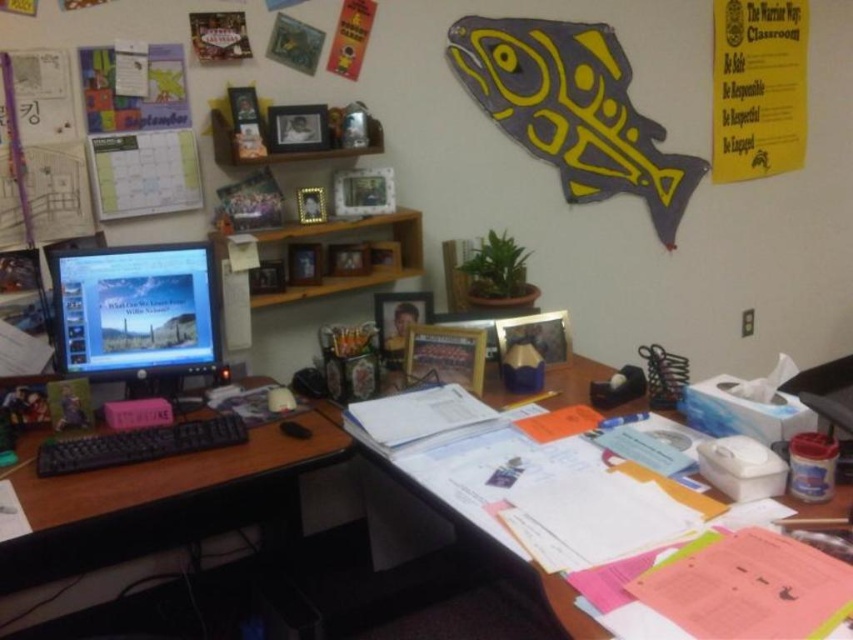
Question: Which object is the farthest from the black plastic keyboard at lower left?

Choices:
 (A) matte black monitor at left
 (B) white paper at center
 (C) black plastic keyboard at left

Answer: (B)

Question: Is the position of black plastic keyboard at left more distant than that of black plastic keyboard at lower left?

Choices:
 (A) yes
 (B) no

Answer: (A)

Question: Which object appears closest to the camera in this image?

Choices:
 (A) black plastic keyboard at lower left
 (B) matte black monitor at left
 (C) black plastic keyboard at left
 (D) white paper at center

Answer: (A)

Question: Which of the following is the farthest from the observer?

Choices:
 (A) black plastic keyboard at lower left
 (B) matte black monitor at left
 (C) black plastic keyboard at left

Answer: (C)

Question: Is black plastic keyboard at left bigger than black plastic keyboard at lower left?

Choices:
 (A) yes
 (B) no

Answer: (A)

Question: Does matte black monitor at left have a smaller size compared to white paper at center?

Choices:
 (A) yes
 (B) no

Answer: (A)